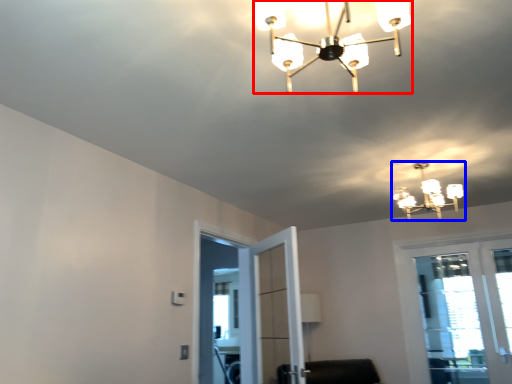
Question: Which object appears farthest to the camera in this image, lamp (highlighted by a red box) or lamp (highlighted by a blue box)?

Choices:
 (A) lamp
 (B) lamp

Answer: (B)